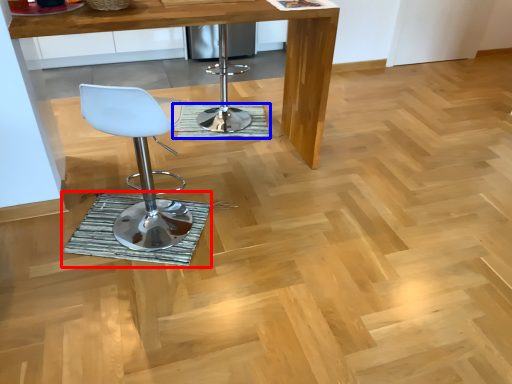
Question: Which object appears farthest to the camera in this image, mat (highlighted by a red box) or mat (highlighted by a blue box)?

Choices:
 (A) mat
 (B) mat

Answer: (B)